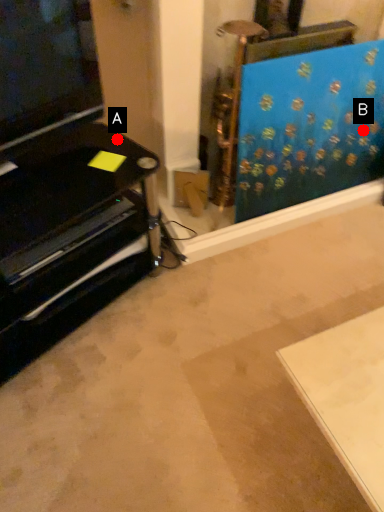
Question: Two points are circled on the image, labeled by A and B beside each circle. Which point is farther from the camera taking this photo?

Choices:
 (A) A is further
 (B) B is further

Answer: (B)